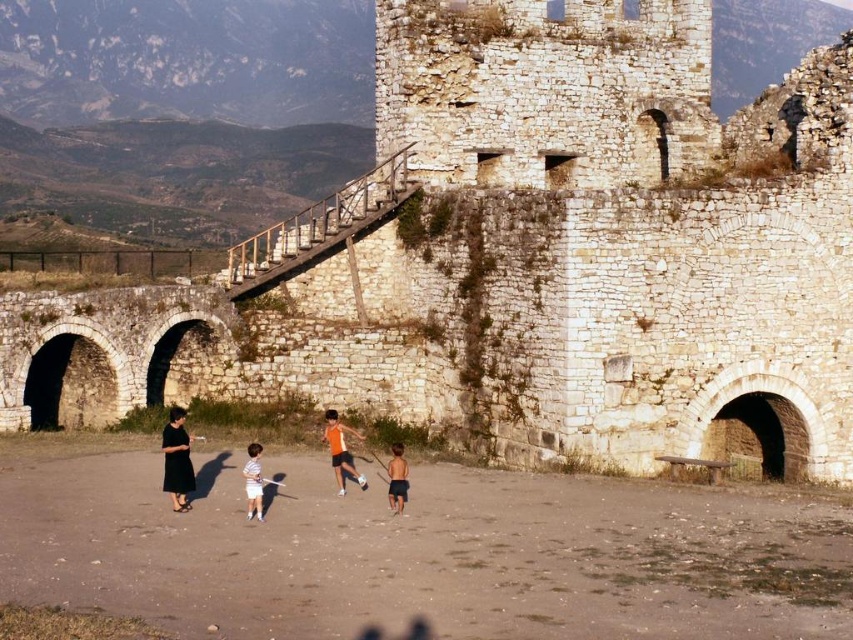
Question: Can you confirm if black dress at lower left is positioned above orange fabric shirt at center?

Choices:
 (A) yes
 (B) no

Answer: (A)

Question: Is black dress at lower left below orange fabric shirt at center?

Choices:
 (A) no
 (B) yes

Answer: (A)

Question: Is striped cotton shirt at center thinner than dark blue shorts at center?

Choices:
 (A) no
 (B) yes

Answer: (A)

Question: Which of the following is the farthest from the observer?

Choices:
 (A) dark blue shorts at center
 (B) striped cotton shirt at center

Answer: (A)

Question: Among these objects, which one is nearest to the camera?

Choices:
 (A) orange fabric shirt at center
 (B) striped cotton shirt at center

Answer: (B)

Question: Which of the following is the farthest from the observer?

Choices:
 (A) striped cotton shirt at center
 (B) orange fabric shirt at center

Answer: (B)